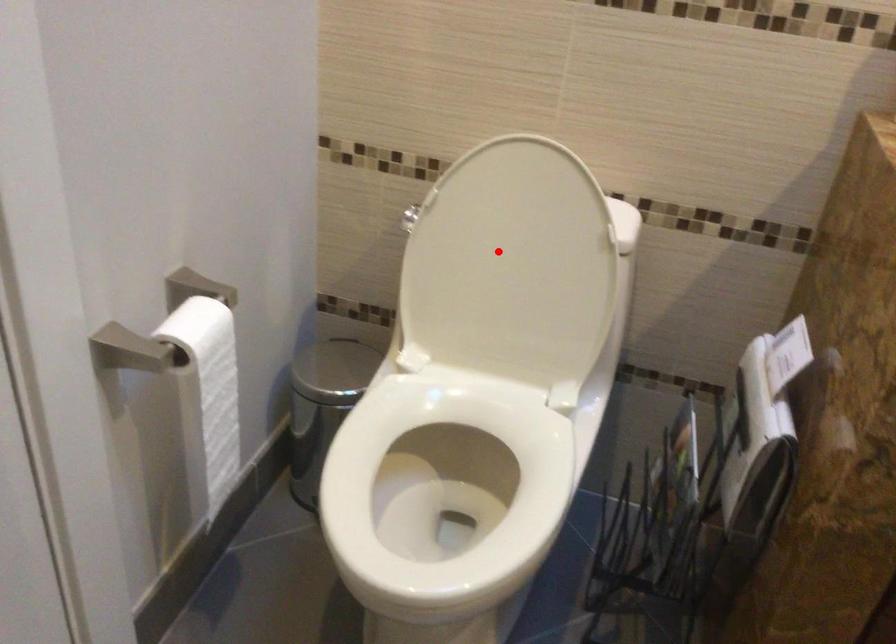
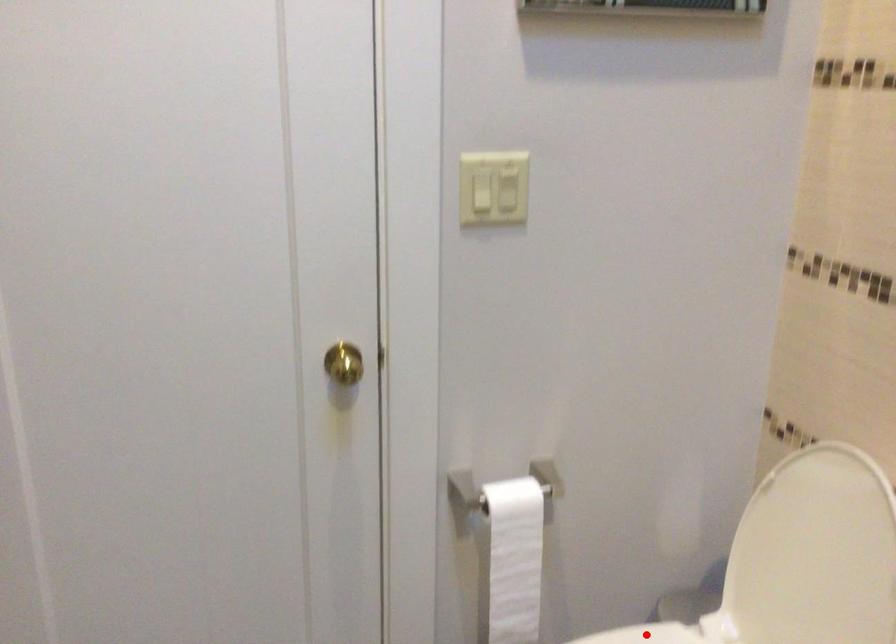
I am providing you with two images of the same scene from different viewpoints. A red point is marked on the first image and another point is marked on the second image. Does the point marked in image1 correspond to the same location as the one in image2?

No